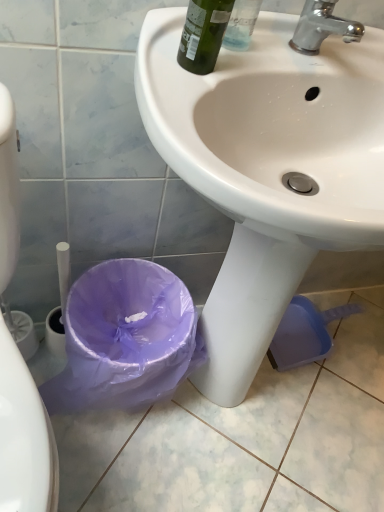
The image size is (384, 512). Identify the location of vacant area that lies to the right of green glass bottle at upper center. (263, 66).